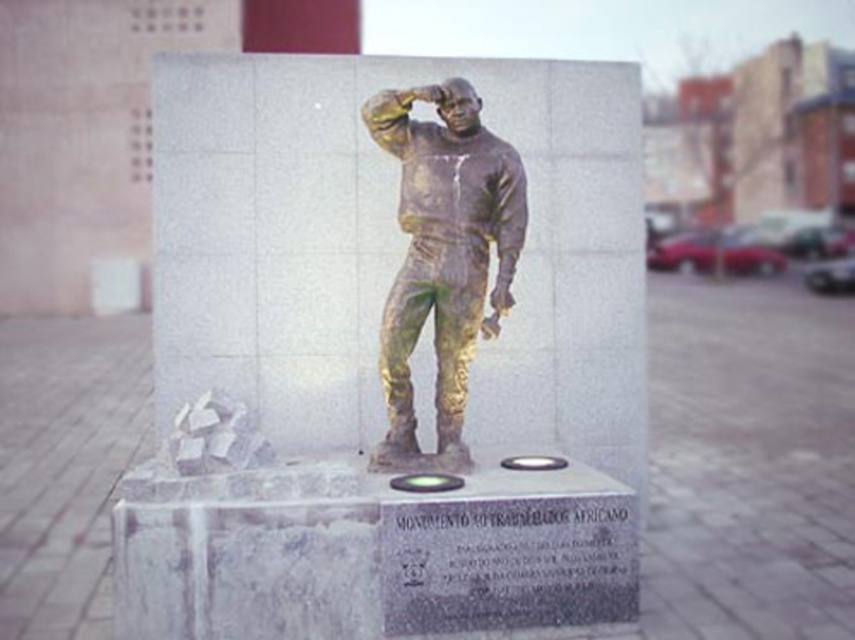
Question: Does bronze statue at center appear under gold patina astronaut at center?

Choices:
 (A) yes
 (B) no

Answer: (B)

Question: Which object is farther from the camera taking this photo?

Choices:
 (A) bronze statue at center
 (B) gold patina astronaut at center

Answer: (A)

Question: Is bronze statue at center smaller than gold patina astronaut at center?

Choices:
 (A) yes
 (B) no

Answer: (B)

Question: Is bronze statue at center bigger than gold patina astronaut at center?

Choices:
 (A) yes
 (B) no

Answer: (A)